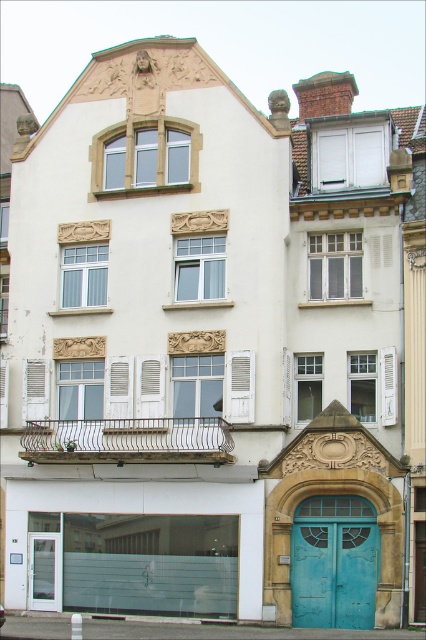
You are a delivery person with a package that requires a 13 meter wide vehicle to pass through. You need to deliver it to the building. Is there enough space between the teal painted wood door at center and the clear glass door at lower left for the vehicle to pass through?

The teal painted wood door at center and clear glass door at lower left are 12.57 meters apart from each other, which is less than the required 13 meters. Therefore, the vehicle cannot pass through the space between them.

You are a delivery person trying to enter the building. You see the teal painted wood door at center and the clear glass door at lower left. Which door should you use to enter the building?

The teal painted wood door at center is located above the clear glass door at lower left, so the clear glass door at lower left is the entrance at ground level and should be used to enter the building.